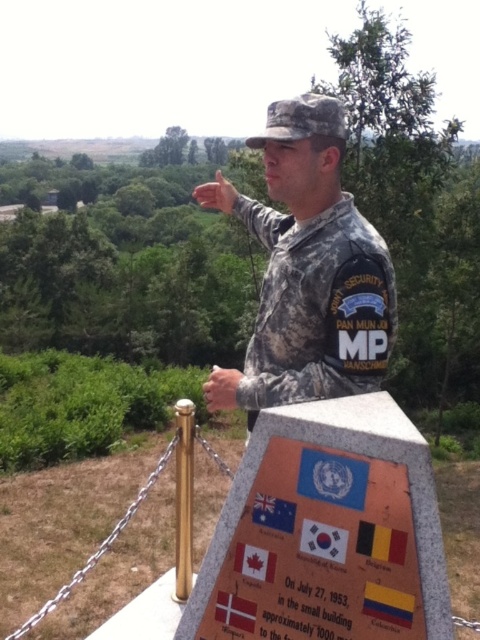
You are a photographer standing 1.5 meters away from the soldier. You want to take a closeup shot of the soldier without moving closer than your current position. Is the camouflage uniform at center within your camera lens range if the minimum focusing distance is 1.5 meters?

The camouflage uniform at center is 1.64 meters away from the viewer. Since the minimum focusing distance is 1.5 meters, the camera can focus on the camouflage uniform at center as it is beyond the minimum required distance.